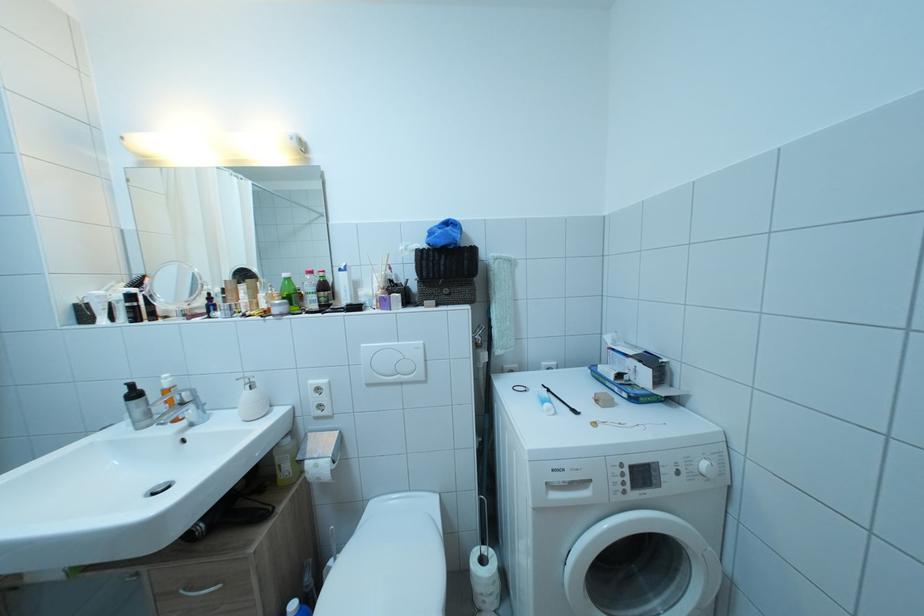
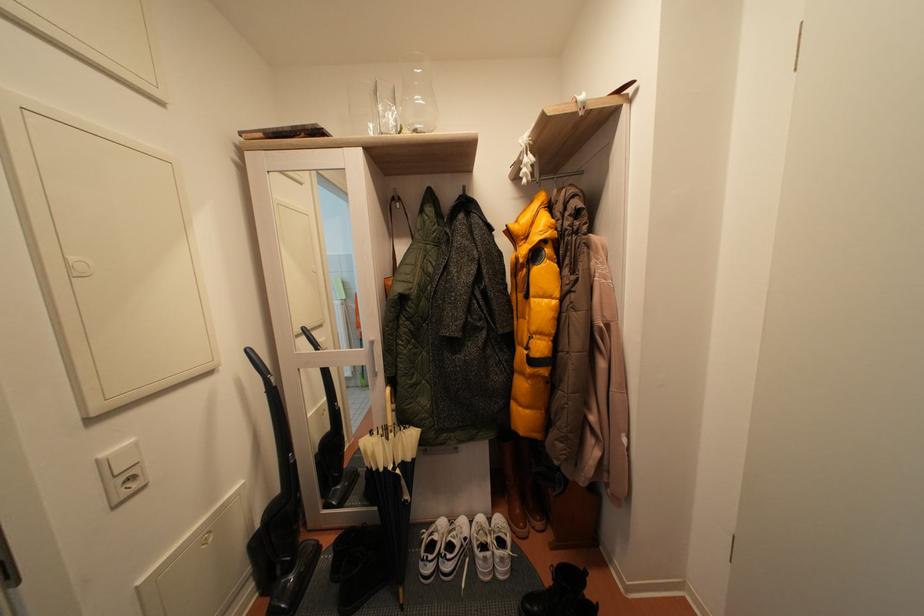
Question: Which direction would the cameraman need to move to produce the second image? Reply with the corresponding letter.

Choices:
 (A) Left
 (B) Right
 (C) Forward
 (D) Backward

Answer: (B)